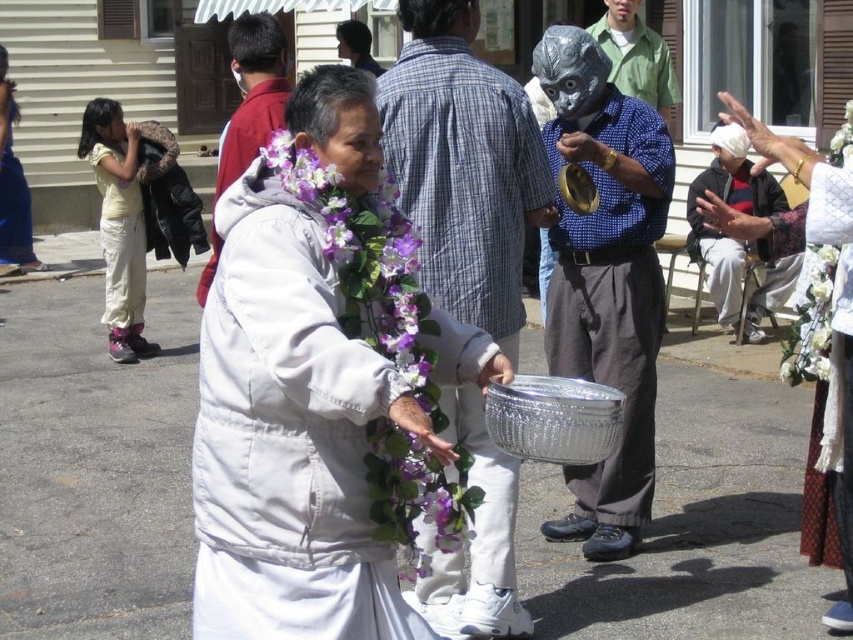
Between point (741, 198) and point (86, 148), which one is positioned in front?

Point (741, 198)

In the scene shown: Which is below, white fabric shirt at right or light yellow cotton shirt at left?

Positioned lower is light yellow cotton shirt at left.

Describe the element at coordinates (734, 237) in the screenshot. I see `white fabric shirt at right` at that location.

Where is `white fabric shirt at right`? The image size is (853, 640). white fabric shirt at right is located at coordinates (734, 237).

Is point (837, 392) positioned behind point (351, 24)?

That is False.

Image resolution: width=853 pixels, height=640 pixels. Describe the element at coordinates (811, 296) in the screenshot. I see `white lace dress at center` at that location.

Which is behind, point (845, 627) or point (349, 44)?

Point (349, 44)

Locate an element on the screen. The width and height of the screenshot is (853, 640). white lace dress at center is located at coordinates (811, 296).

Which of these two, white cotton pants at left or smooth brown leather jacket at upper center, stands taller?

With more height is white cotton pants at left.

Find the location of a particular element. The height and width of the screenshot is (640, 853). white cotton pants at left is located at coordinates (120, 243).

Who is more forward, (131, 180) or (347, 51)?

Point (131, 180)

Where is `white cotton pants at left`? This screenshot has height=640, width=853. white cotton pants at left is located at coordinates (120, 243).